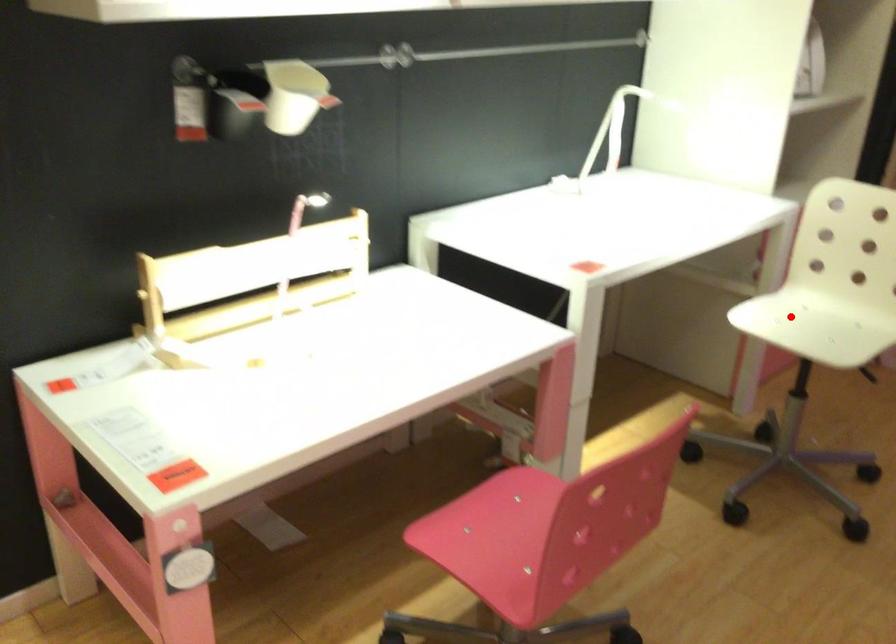
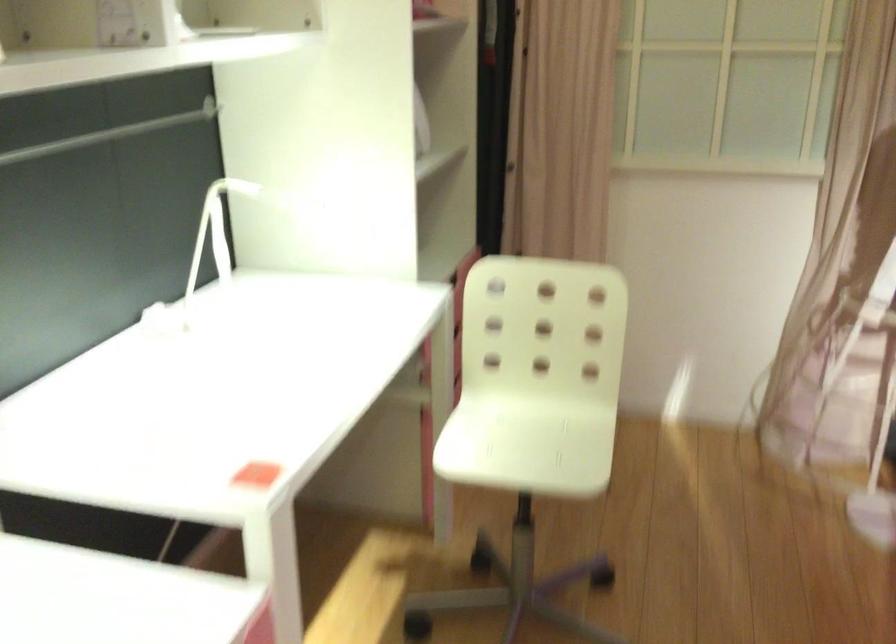
Find the pixel in the second image that matches the highlighted location in the first image.

(495, 431)